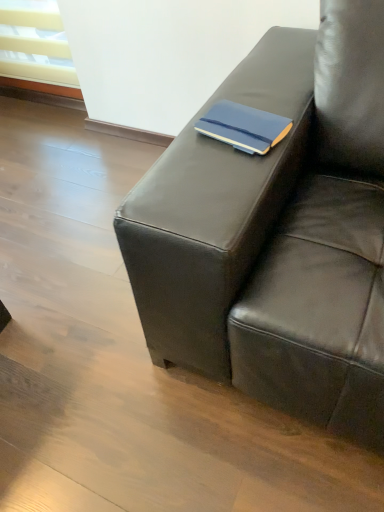
Question: In terms of width, does matte black couch at center look wider or thinner when compared to matte blue notebook at center?

Choices:
 (A) wide
 (B) thin

Answer: (A)

Question: Would you say matte black couch at center is to the left or to the right of matte blue notebook at center in the picture?

Choices:
 (A) left
 (B) right

Answer: (B)

Question: Considering the positions of point pos(304,286) and point pos(289,122), is point pos(304,286) closer or farther from the camera than point pos(289,122)?

Choices:
 (A) farther
 (B) closer

Answer: (B)

Question: From the image's perspective, is matte blue notebook at center positioned above or below matte black couch at center?

Choices:
 (A) below
 (B) above

Answer: (B)

Question: Does point (278, 140) appear closer or farther from the camera than point (264, 203)?

Choices:
 (A) farther
 (B) closer

Answer: (A)

Question: Looking at the image, does matte blue notebook at center seem bigger or smaller compared to matte black couch at center?

Choices:
 (A) big
 (B) small

Answer: (B)

Question: In the image, is matte blue notebook at center positioned in front of or behind matte black couch at center?

Choices:
 (A) front
 (B) behind

Answer: (B)